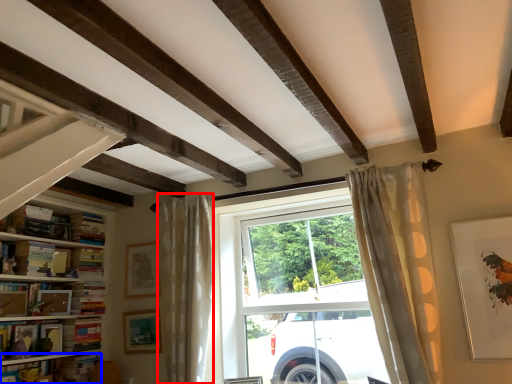
Question: Which of the following is the closest to the observer, curtain (highlighted by a red box) or book (highlighted by a blue box)?

Choices:
 (A) curtain
 (B) book

Answer: (A)